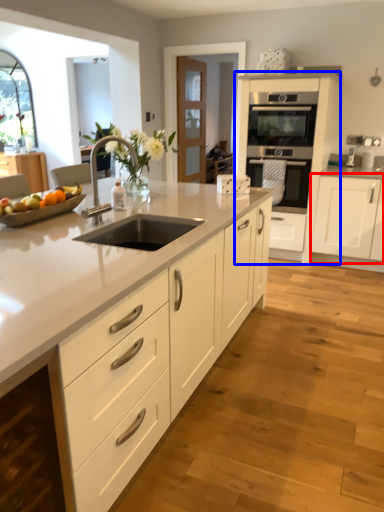
Question: Which of the following is the closest to the observer, cabinetry (highlighted by a red box) or cabinetry (highlighted by a blue box)?

Choices:
 (A) cabinetry
 (B) cabinetry

Answer: (A)